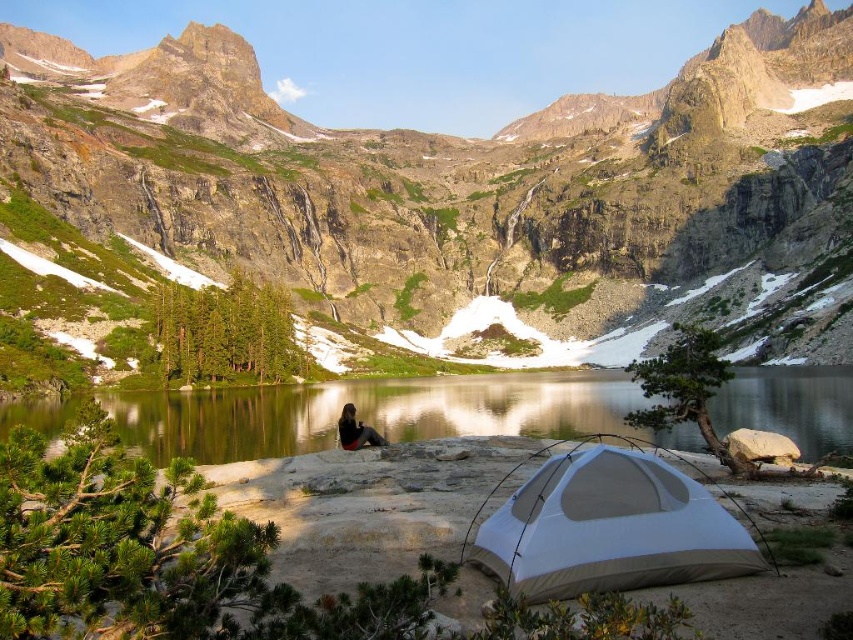
Question: Based on their relative distances, which object is farther from the white fabric tent at lower right?

Choices:
 (A) clear glass water at center
 (B) rocky cliff at center
 (C) black fabric person at center

Answer: (B)

Question: Can you confirm if rocky cliff at center is positioned to the left of clear glass water at center?

Choices:
 (A) yes
 (B) no

Answer: (A)

Question: Which of the following is the farthest from the observer?

Choices:
 (A) clear glass water at center
 (B) black fabric person at center

Answer: (B)

Question: Which point is farther to the camera?

Choices:
 (A) black fabric person at center
 (B) white fabric tent at lower right

Answer: (A)

Question: Is the position of rocky cliff at center less distant than that of white fabric tent at lower right?

Choices:
 (A) yes
 (B) no

Answer: (B)

Question: Does white fabric tent at lower right appear under black fabric person at center?

Choices:
 (A) yes
 (B) no

Answer: (A)